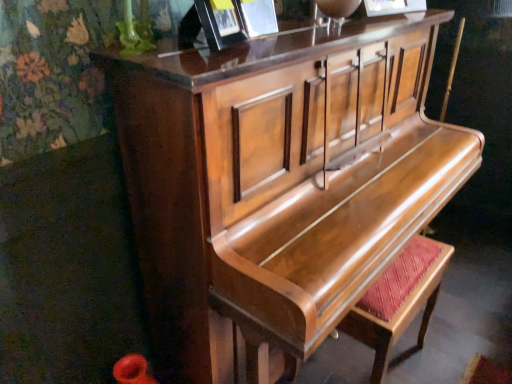
Where is `vacant space situated above wooden armchair at lower right (from a real-world perspective)`? vacant space situated above wooden armchair at lower right (from a real-world perspective) is located at coordinates (400, 275).